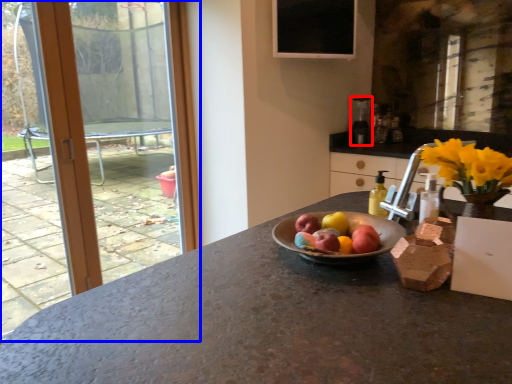
Question: Which of the following is the farthest to the observer, appliance (highlighted by a red box) or window (highlighted by a blue box)?

Choices:
 (A) appliance
 (B) window

Answer: (A)